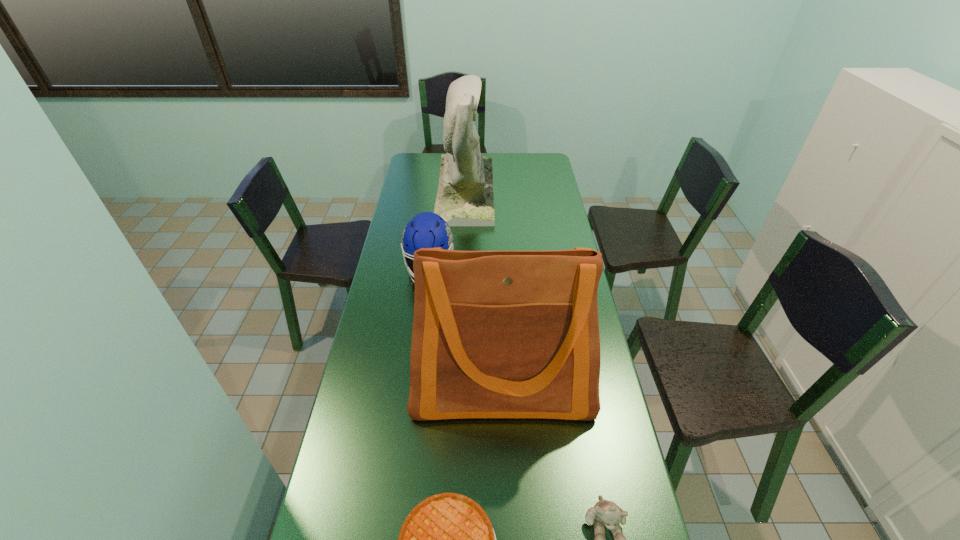
Where is `sculpture`? sculpture is located at coordinates (465, 197).

The height and width of the screenshot is (540, 960). What are the coordinates of `the third nearest object` in the screenshot? It's located at (496, 334).

Where is `the fourth nearest object`? The image size is (960, 540). the fourth nearest object is located at coordinates (427, 229).

You are a GUI agent. You are given a task and a screenshot of the screen. Output one action in this format:
    pyautogui.click(x=<x>, y=<y>)
    Task: Click on the football helmet
    Image resolution: width=960 pixels, height=540 pixels.
    Given the screenshot: What is the action you would take?
    pyautogui.click(x=427, y=229)

Image resolution: width=960 pixels, height=540 pixels. What are the coordinates of `free location located 0.070m on the base of the farthest object` in the screenshot? It's located at (508, 191).

The image size is (960, 540). Identify the location of vacant position located 0.270m on the front pocket of the shopping bag. (509, 539).

The image size is (960, 540). Identify the location of vacant area situated 0.100m on the face guard of the third tallest object. point(423,313).

Identify the location of object at the far edge. (465, 197).

Where is `object at the left edge`? object at the left edge is located at coordinates (427, 229).

The height and width of the screenshot is (540, 960). In order to click on object present at the right edge in this screenshot , I will do `click(496, 334)`.